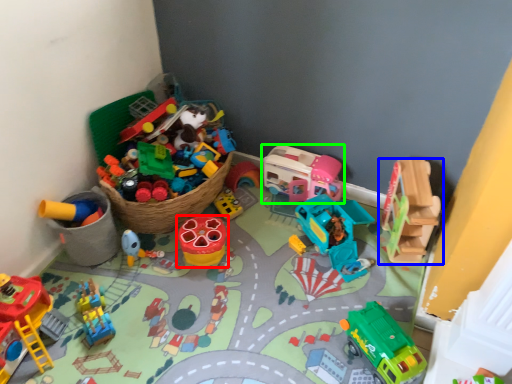
Question: Which object is the closest to the toy (highlighted by a red box)? Choose among these: toy (highlighted by a blue box) or toy (highlighted by a green box).

Choices:
 (A) toy
 (B) toy

Answer: (B)